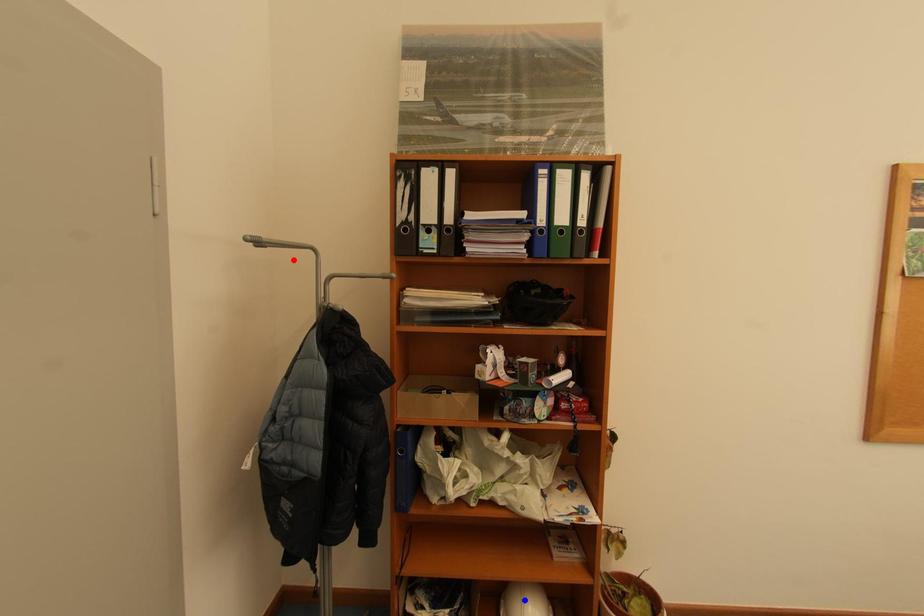
Question: In the image, two points are highlighted. Which point is nearer to the camera? Reply with the corresponding letter.

Choices:
 (A) blue point
 (B) red point

Answer: (B)